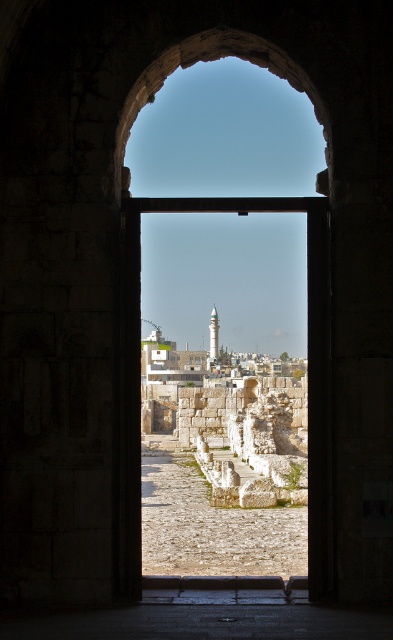
Between stone archway at center and white marble minaret at center, which one has less height?

stone archway at center

Locate an element on the screen. stone archway at center is located at coordinates (308, 378).

At what (x,y) coordinates should I click in order to perform the action: click on stone archway at center. Please return your answer as a coordinate pair (x, y). The width and height of the screenshot is (393, 640). Looking at the image, I should click on (308, 378).